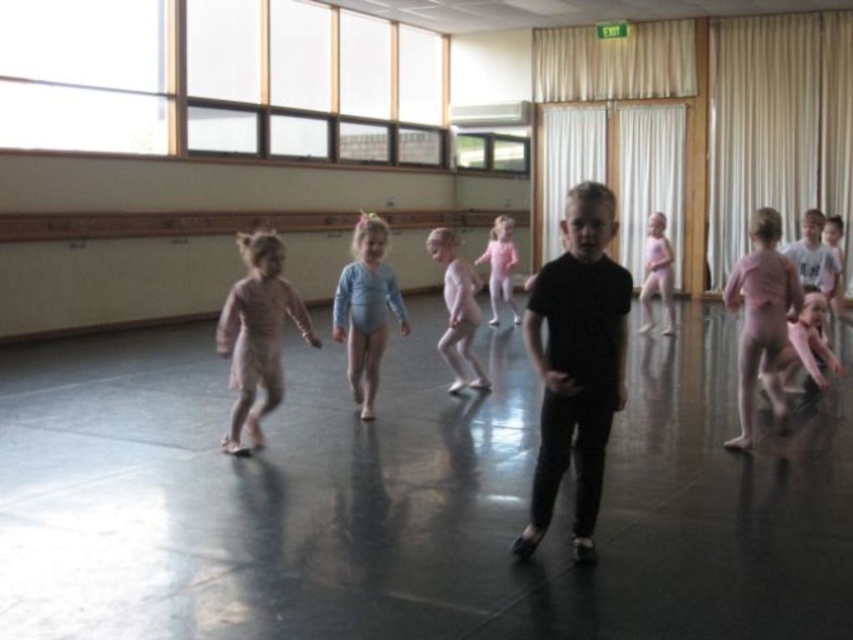
You are a photographer setting up a shoot in the dance studio. You need to capture both the pink satin dress at center and the pink satin leotard at center in the same frame. Since the dress is under the leotard, which one should you adjust to ensure both are visible?

Since the pink satin dress at center is positioned under the pink satin leotard at center, you should adjust the dress to move it out from under the leotard to ensure both are visible.

You are a photographer positioned at the front of the dance studio. You want to take a photo of two specific points in the scene, namely point (x=606, y=195) and point (x=641, y=291). Based on their positions, which point is closer to your camera?

Point (x=606, y=195) is closer to the camera than point (x=641, y=291).